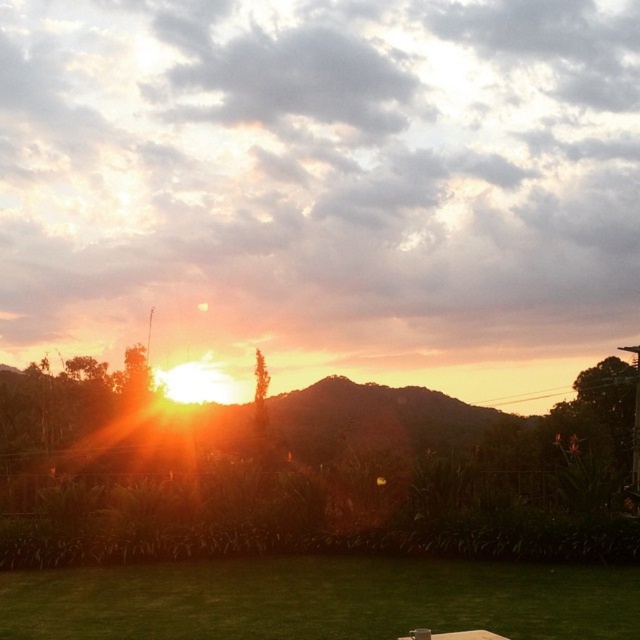
Who is more forward, (189, 632) or (456, 634)?

Point (456, 634) is more forward.

The image size is (640, 640). Describe the element at coordinates (320, 600) in the screenshot. I see `green grass at lower center` at that location.

Locate an element on the screen. green grass at lower center is located at coordinates (320, 600).